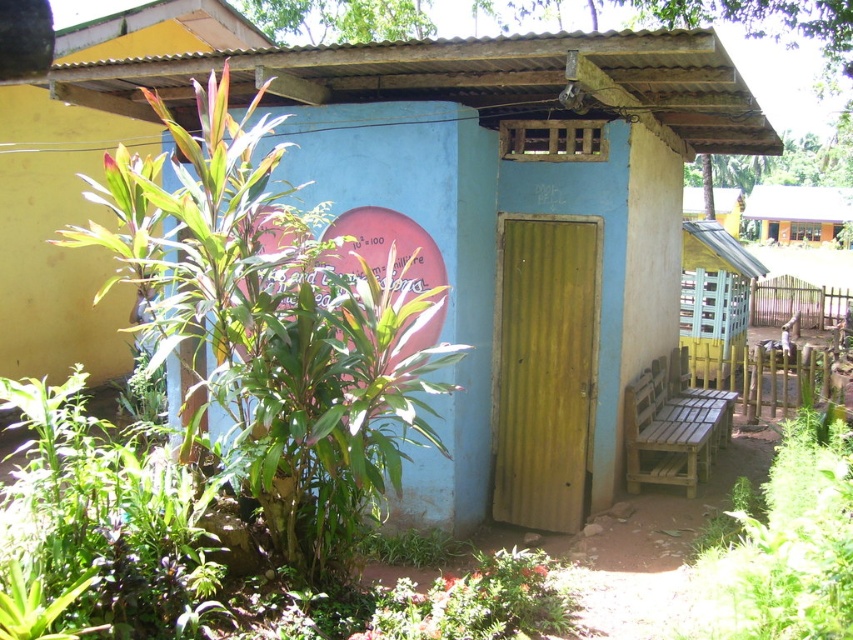
Question: Can you confirm if wooden bench at center is thinner than metallic roof at upper right?

Choices:
 (A) no
 (B) yes

Answer: (B)

Question: Considering the relative positions of wooden bench at center and metallic roof at upper right in the image provided, where is wooden bench at center located with respect to metallic roof at upper right?

Choices:
 (A) right
 (B) left

Answer: (A)

Question: Considering the real-world distances, which object is closest to the metallic roof at upper right?

Choices:
 (A) wooden bench at right
 (B) wooden bench at center
 (C) green corrugated door at center

Answer: (B)

Question: Which point is farther to the camera?

Choices:
 (A) wooden bench at center
 (B) green corrugated door at center

Answer: (A)

Question: Among these objects, which one is farthest from the camera?

Choices:
 (A) wooden bench at right
 (B) wooden bench at center
 (C) metallic roof at upper right
 (D) green corrugated door at center

Answer: (B)

Question: Is the position of wooden bench at right more distant than that of wooden bench at center?

Choices:
 (A) no
 (B) yes

Answer: (A)